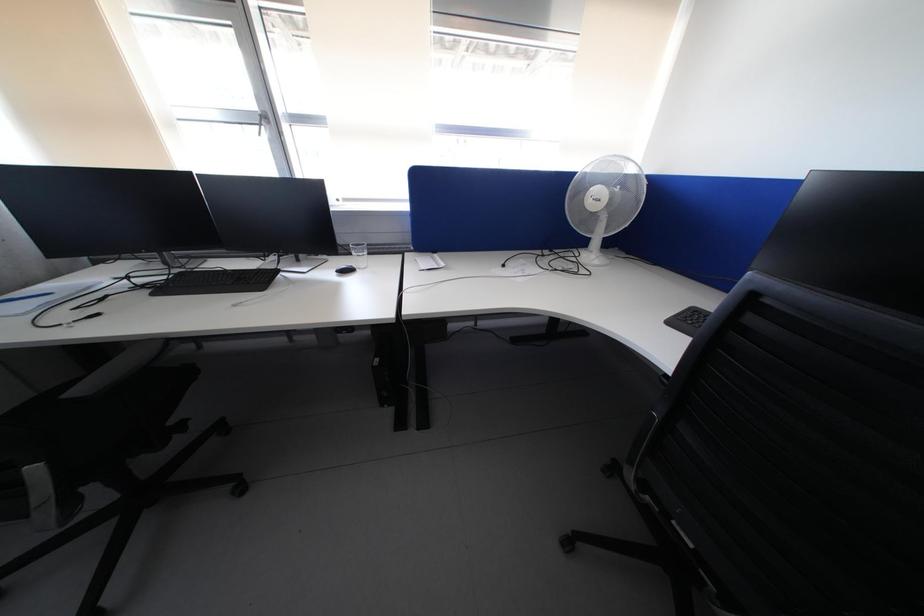
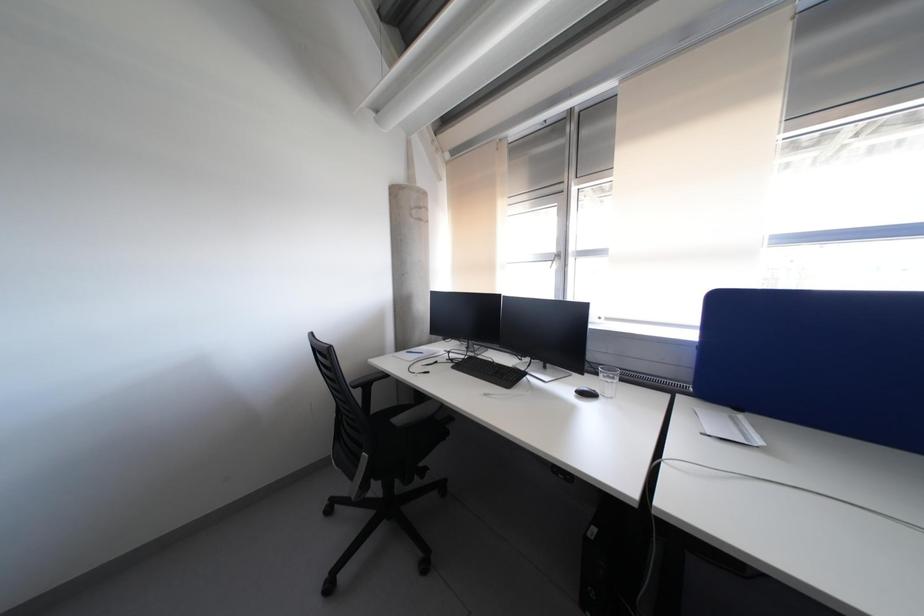
Question: The camera is either moving clockwise (left) or counter-clockwise (right) around the object. The first image is from the beginning of the video and the second image is from the end. Is the camera moving left or right when shooting the video?

Choices:
 (A) Left
 (B) Right

Answer: (B)